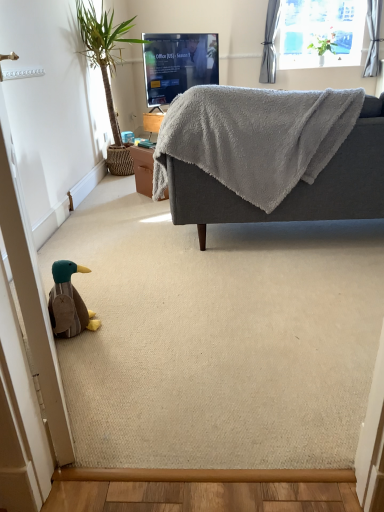
Where is `free space in front of green leafy plant at left`? free space in front of green leafy plant at left is located at coordinates (113, 192).